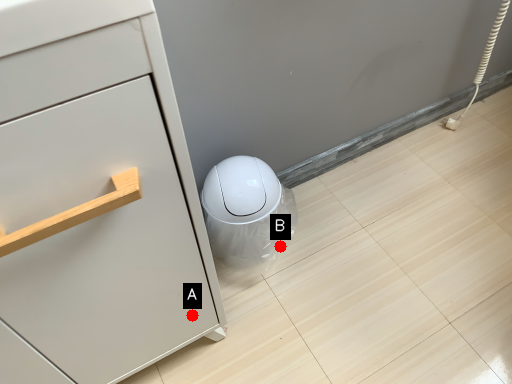
Question: Two points are circled on the image, labeled by A and B beside each circle. Which of the following is the closest to the observer?

Choices:
 (A) A is closer
 (B) B is closer

Answer: (A)